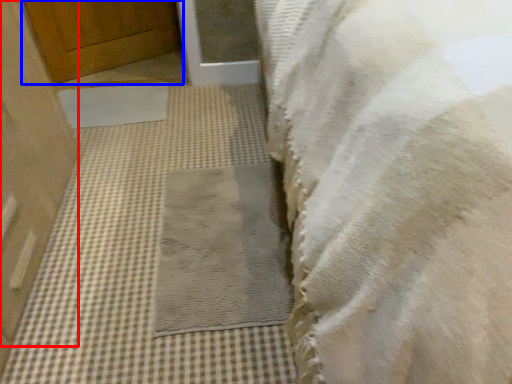
Question: Which point is further to the camera, door (highlighted by a red box) or door (highlighted by a blue box)?

Choices:
 (A) door
 (B) door

Answer: (B)